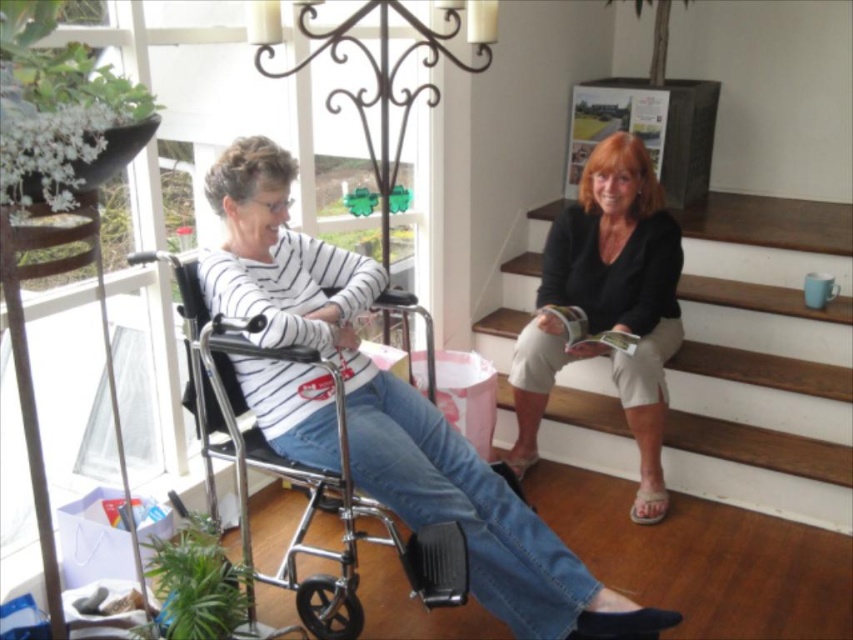
Question: Does striped cotton shirt at left appear on the right side of beige cotton shorts at center?

Choices:
 (A) yes
 (B) no

Answer: (B)

Question: Does wooden stair at upper right appear under silver metallic wheelchair at left?

Choices:
 (A) no
 (B) yes

Answer: (A)

Question: Which of the following is the farthest from the observer?

Choices:
 (A) beige fabric sandal at lower right
 (B) striped cotton shirt at left

Answer: (A)

Question: Based on their relative distances, which object is nearer to the beige fabric sandal at lower right?

Choices:
 (A) striped cotton shirt at left
 (B) silver metallic wheelchair at left
 (C) wooden stair at upper right
 (D) beige cotton shorts at center

Answer: (D)

Question: Among these objects, which one is nearest to the camera?

Choices:
 (A) white fabric sandal at lower right
 (B) beige fabric sandal at lower right
 (C) beige cotton shorts at center

Answer: (C)

Question: Is beige cotton shorts at center above silver metallic wheelchair at left?

Choices:
 (A) no
 (B) yes

Answer: (B)